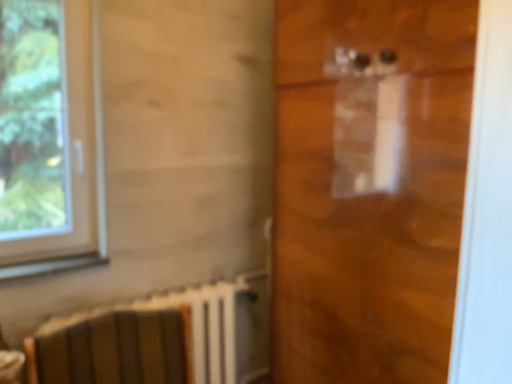
Question: Is transparent plastic door at center inside or outside of wooden armchair at lower left?

Choices:
 (A) inside
 (B) outside

Answer: (B)

Question: Is transparent plastic door at center bigger or smaller than wooden armchair at lower left?

Choices:
 (A) small
 (B) big

Answer: (B)

Question: Estimate the real-world distances between objects in this image. Which object is closer to the wooden armchair at lower left?

Choices:
 (A) matte brown table at lower left
 (B) transparent plastic door at center
 (C) white plastic window at left

Answer: (A)

Question: Considering the real-world distances, which object is closest to the matte brown table at lower left?

Choices:
 (A) wooden armchair at lower left
 (B) transparent plastic door at center
 (C) white plastic window at left

Answer: (A)